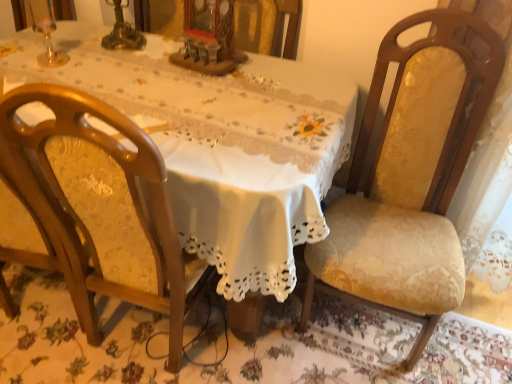
This screenshot has height=384, width=512. Find the location of `free spot below velvet yellow chair at right, marked as the 1th chair in a right-to-left arrangement (from a real-world perspective)`. free spot below velvet yellow chair at right, marked as the 1th chair in a right-to-left arrangement (from a real-world perspective) is located at coordinates (369, 339).